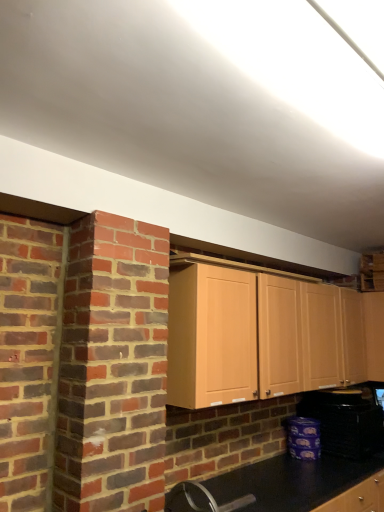
Question: Would you say black plastic toaster at lower right is inside or outside light wood cabinet at center?

Choices:
 (A) outside
 (B) inside

Answer: (A)

Question: In terms of width, does black plastic toaster at lower right look wider or thinner when compared to light wood cabinet at center?

Choices:
 (A) thin
 (B) wide

Answer: (B)

Question: Would you say black plastic toaster at lower right is to the left or to the right of light wood cabinet at center in the picture?

Choices:
 (A) right
 (B) left

Answer: (A)

Question: In terms of size, does light wood cabinet at center appear bigger or smaller than black plastic toaster at lower right?

Choices:
 (A) small
 (B) big

Answer: (B)

Question: Choose the correct answer: Is light wood cabinet at center inside black plastic toaster at lower right or outside it?

Choices:
 (A) outside
 (B) inside

Answer: (A)

Question: From the image's perspective, is light wood cabinet at center located above or below black plastic toaster at lower right?

Choices:
 (A) below
 (B) above

Answer: (B)

Question: Based on their positions, is light wood cabinet at center located to the left or right of black plastic toaster at lower right?

Choices:
 (A) left
 (B) right

Answer: (A)